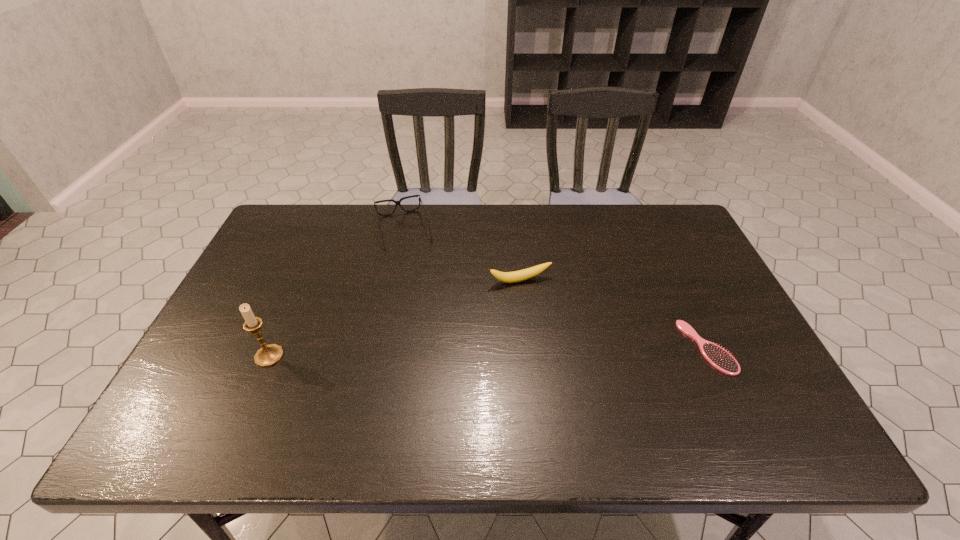
Find the location of a particular element. This screenshot has height=540, width=960. vacant region located 0.360m on the upward curve of the second farthest object is located at coordinates (577, 394).

At what (x,y) coordinates should I click in order to perform the action: click on vacant space located on the upward curve of the second farthest object. Please return your answer as a coordinate pair (x, y). The image size is (960, 540). Looking at the image, I should click on (554, 343).

Where is `vacant space located 0.170m on the upward curve of the second farthest object`? vacant space located 0.170m on the upward curve of the second farthest object is located at coordinates (548, 332).

Identify the location of free location located with the lenses facing outward on the second object from left to right. The height and width of the screenshot is (540, 960). (431, 327).

At what (x,y) coordinates should I click in order to perform the action: click on vacant region located with the lenses facing outward on the second object from left to right. Please return your answer as a coordinate pair (x, y). The image size is (960, 540). Looking at the image, I should click on (421, 295).

The height and width of the screenshot is (540, 960). What are the coordinates of `vacant area situated with the lenses facing outward on the second object from left to right` in the screenshot? It's located at (437, 347).

Find the location of `object present at the far edge`. object present at the far edge is located at coordinates (396, 202).

Locate an element on the screen. This screenshot has width=960, height=540. object situated at the near edge is located at coordinates (718, 357).

Locate an element on the screen. object that is at the left edge is located at coordinates (268, 355).

Locate an element on the screen. Image resolution: width=960 pixels, height=540 pixels. object situated at the right edge is located at coordinates (718, 357).